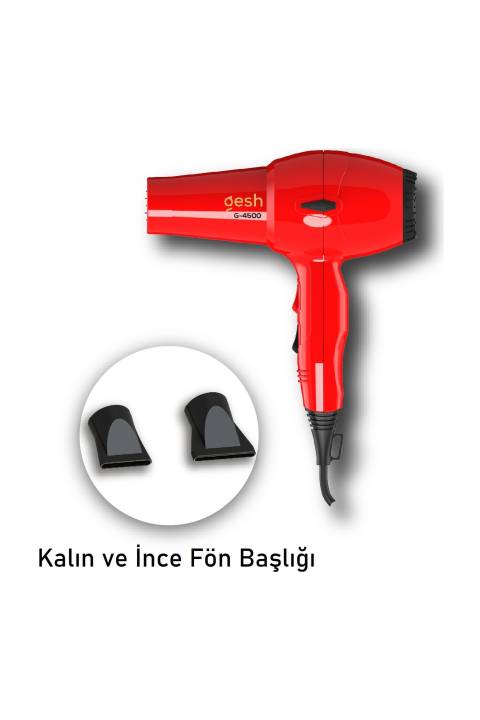
Locate an element on the screen. black cord is located at coordinates (326, 487).